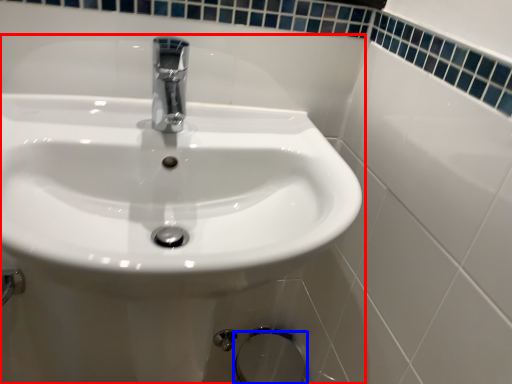
Question: Among these objects, which one is farthest to the camera, sink (highlighted by a red box) or bidet (highlighted by a blue box)?

Choices:
 (A) sink
 (B) bidet

Answer: (B)